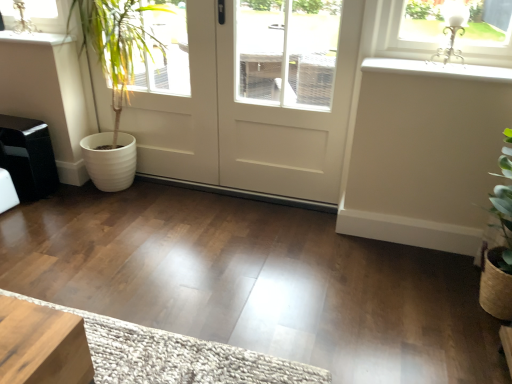
Where is `free space to the left of white matte door at center`? This screenshot has width=512, height=384. free space to the left of white matte door at center is located at coordinates (118, 208).